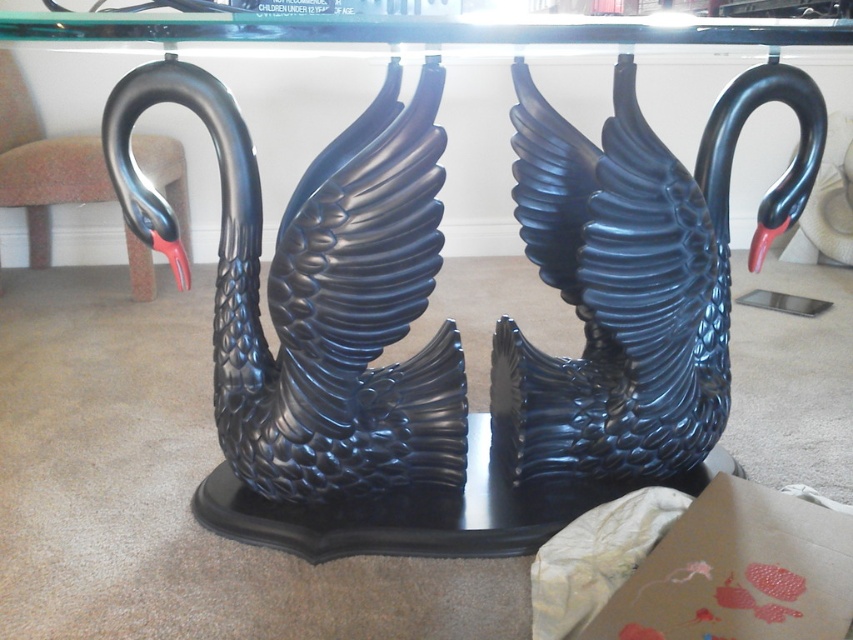
Is glossy black swan at left to the right of glossy black swan at center from the viewer's perspective?

In fact, glossy black swan at left is to the left of glossy black swan at center.

Can you confirm if glossy black swan at left is thinner than glossy black swan at center?

No.

This screenshot has width=853, height=640. In order to click on glossy black swan at left in this screenshot , I will do `click(317, 292)`.